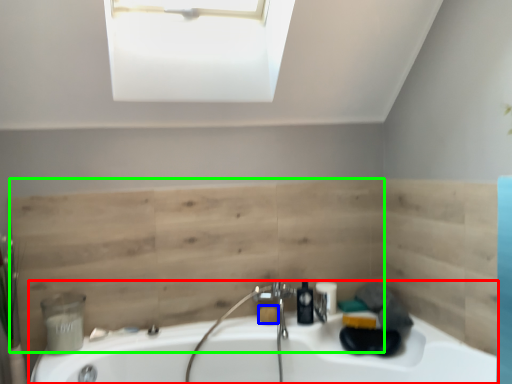
Question: Which object is the farthest from bathtub (highlighted by a red box)? Choose among these: soap (highlighted by a blue box) or plywood (highlighted by a green box).

Choices:
 (A) soap
 (B) plywood

Answer: (A)